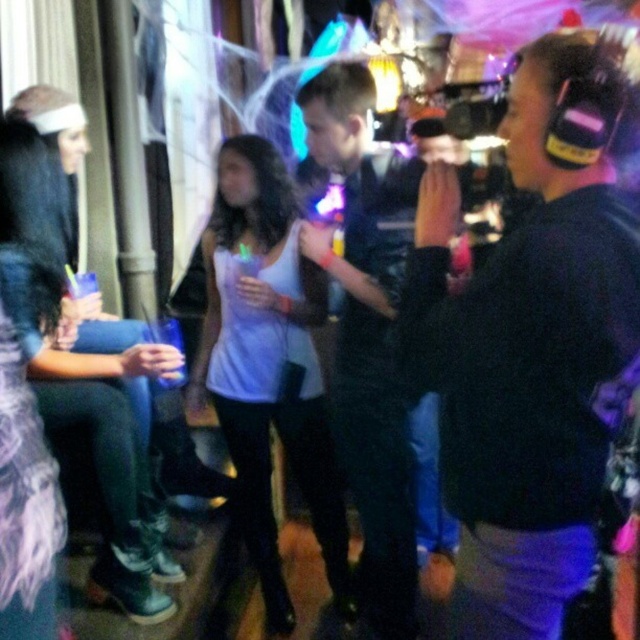
Question: Considering the real-world distances, which object is closest to the white matte tank top at center?

Choices:
 (A) black matte headphones at right
 (B) black leather jacket at center

Answer: (B)

Question: Can you confirm if white matte tank top at center is thinner than black leather jacket at center?

Choices:
 (A) yes
 (B) no

Answer: (B)

Question: Can you confirm if black matte headphones at right is positioned to the right of black leather jacket at center?

Choices:
 (A) yes
 (B) no

Answer: (A)

Question: Which of the following is the closest to the observer?

Choices:
 (A) (275, 163)
 (B) (634, 330)
 (C) (49, 317)

Answer: (B)

Question: Which point appears farthest from the camera in this image?

Choices:
 (A) (106, 400)
 (B) (589, 52)

Answer: (A)

Question: Does white matte tank top at center have a smaller size compared to matte white tank top at center?

Choices:
 (A) yes
 (B) no

Answer: (B)